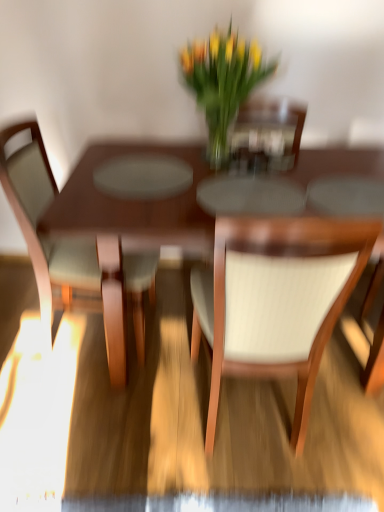
At what (x,y) coordinates should I click in order to perform the action: click on vacant area that is in front of light brown wood chair at left, the second chair from the right. Please return your answer as a coordinate pair (x, y). This screenshot has height=512, width=384. Looking at the image, I should click on (74, 428).